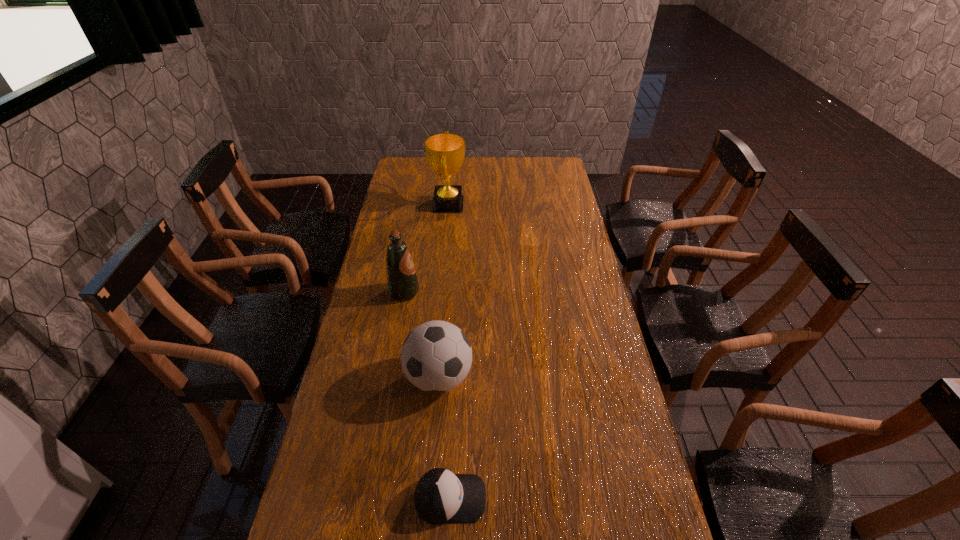
Locate an element on the screen. object present at the left edge is located at coordinates (402, 282).

In the image, there is a desktop. What are the coordinates of `free space at the far edge` in the screenshot? It's located at (467, 171).

You are a GUI agent. You are given a task and a screenshot of the screen. Output one action in this format:
    pyautogui.click(x=<x>, y=<y>)
    Task: Click on the free space at the left edge
    The height and width of the screenshot is (540, 960).
    Given the screenshot: What is the action you would take?
    pyautogui.click(x=322, y=487)

Image resolution: width=960 pixels, height=540 pixels. Find the location of `vacant area at the right edge of the desktop`. vacant area at the right edge of the desktop is located at coordinates point(596,315).

Identify the location of vacant space at the far left corner of the desktop. The width and height of the screenshot is (960, 540). (415, 166).

Find the location of a particular element. free space at the far right corner of the desktop is located at coordinates (551, 178).

Where is `free space between the shortest object and the soccer ball`? free space between the shortest object and the soccer ball is located at coordinates (444, 437).

Where is `vacant area that lies between the cap and the second shortest object`? vacant area that lies between the cap and the second shortest object is located at coordinates (444, 437).

At what (x,y) coordinates should I click in order to perform the action: click on free space between the third nearest object and the cap. Please return your answer as a coordinate pair (x, y). This screenshot has height=540, width=960. Looking at the image, I should click on (427, 395).

Locate an element on the screen. free space that is in between the award and the soccer ball is located at coordinates (444, 291).